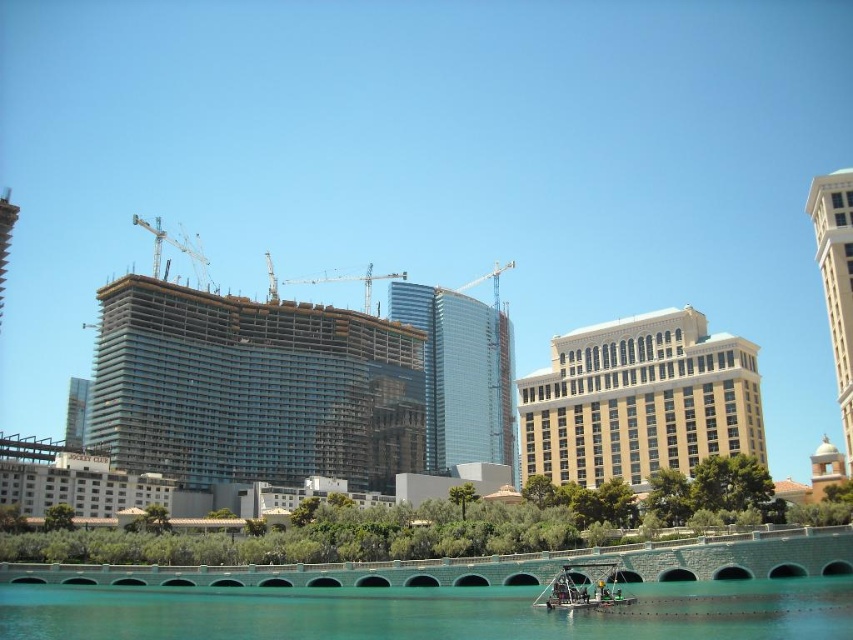
Question: Which of the following is the closest to the observer?

Choices:
 (A) (86, 440)
 (B) (492, 266)

Answer: (A)

Question: Is teal concrete bridge at lower center closer to the viewer compared to green metallic boat at lower center?

Choices:
 (A) no
 (B) yes

Answer: (B)

Question: Among these points, which one is farthest from the camera?

Choices:
 (A) (364, 296)
 (B) (474, 278)
 (C) (70, 563)

Answer: (B)

Question: Does beige marble tower at upper right appear over green metallic boat at lower center?

Choices:
 (A) yes
 (B) no

Answer: (A)

Question: Is the position of glassy blue building at center less distant than that of beige marble tower at upper right?

Choices:
 (A) no
 (B) yes

Answer: (A)

Question: Which point is farther to the camera?

Choices:
 (A) (395, 355)
 (B) (755, 582)
 (C) (196, 259)
 (D) (492, 276)

Answer: (D)